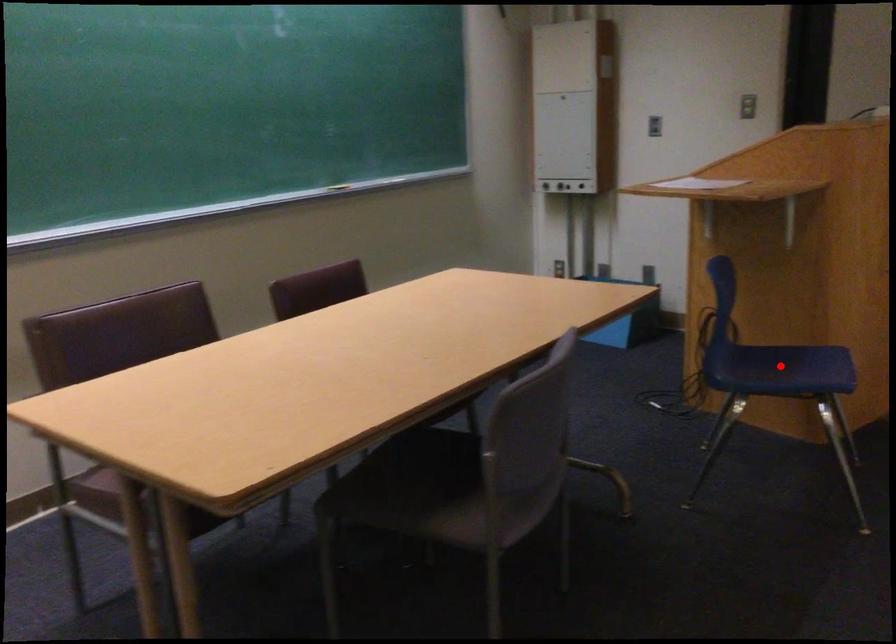
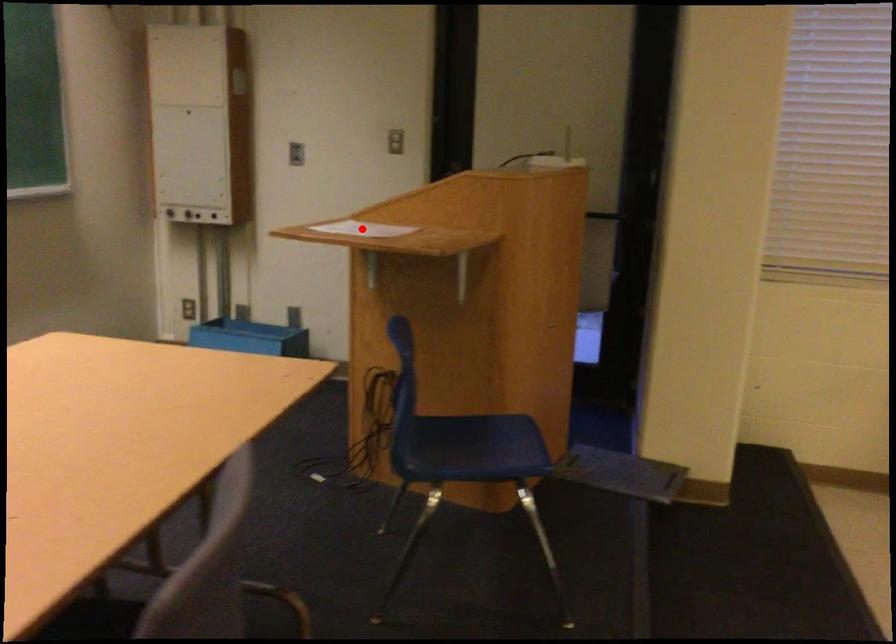
I am providing you with two images of the same scene from different viewpoints. A red point is marked on the first image and another point is marked on the second image. Does the point marked in image1 correspond to the same location as the one in image2?

No